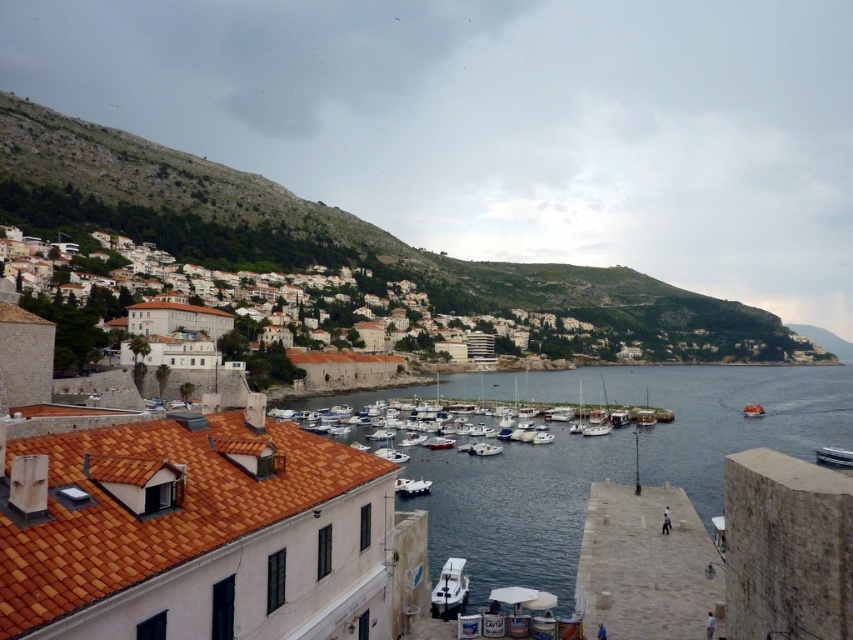
You are a delivery drone with a wingspan of 1.5 meters. You need to fly from the stone pier at lower right to the white glossy boat at lower right. Is there enough space between them for your drone to pass through safely?

The stone pier at lower right and white glossy boat at lower right are 33.19 meters apart. Since the distance between them is much larger than the drone wingspan of 1.5 meters, there is sufficient space for the drone to pass safely.

You are standing at the point marked as point (628, 538) in the coastal scene. The camera is positioned at a higher vantage point overlooking the harbor. Can you estimate how far you are from the camera?

The distance of point (628, 538) from camera is 55.00 meters, so you are 55.00 meters away from the camera.

You are standing on the stone pier at lower right and want to see the white glossy boat at lower right. Can you see it clearly without any obstructions?

The stone pier at lower right is in front of the white glossy boat at lower right, so it may block your view of the boat.